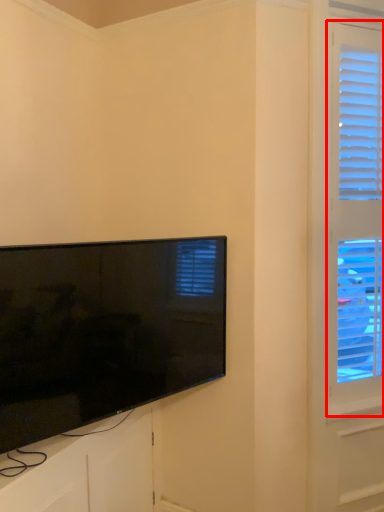
Question: Where is window (annotated by the red box) located in relation to television in the image?

Choices:
 (A) left
 (B) right

Answer: (B)